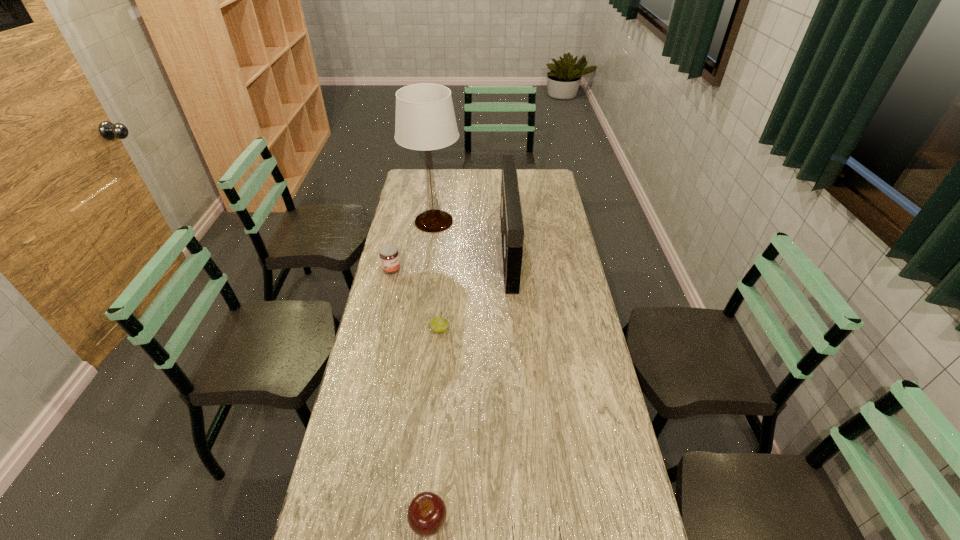
Locate an element on the screen. The height and width of the screenshot is (540, 960). free area in between the fourth farthest object and the jam is located at coordinates (416, 300).

Locate an element on the screen. This screenshot has height=540, width=960. the fourth closest object to the tallest object is located at coordinates (426, 515).

Locate which object is the closest to the shortest object. Please provide its 2D coordinates. Your answer should be formatted as a tuple, i.e. [(x, y)], where the tuple contains the x and y coordinates of a point satisfying the conditions above.

[(426, 515)]